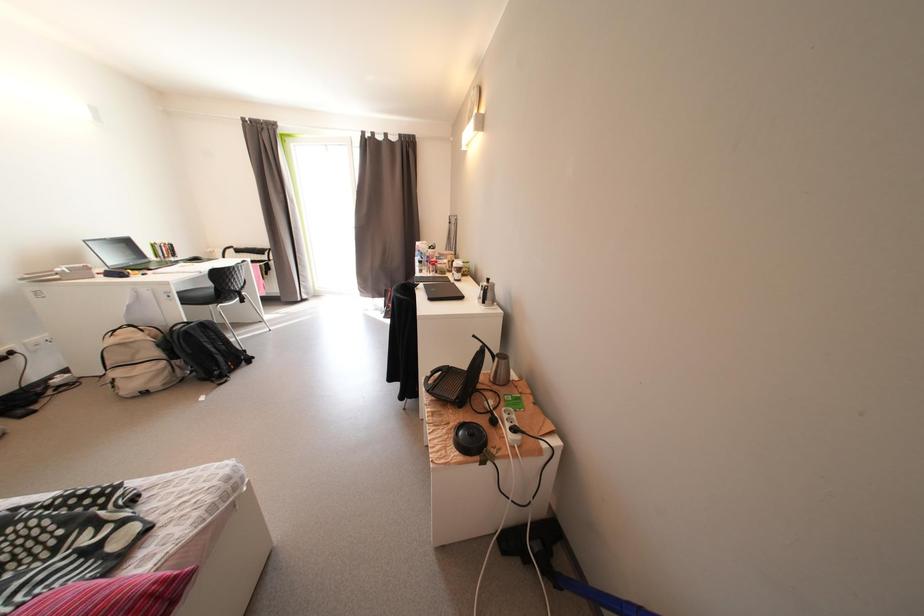
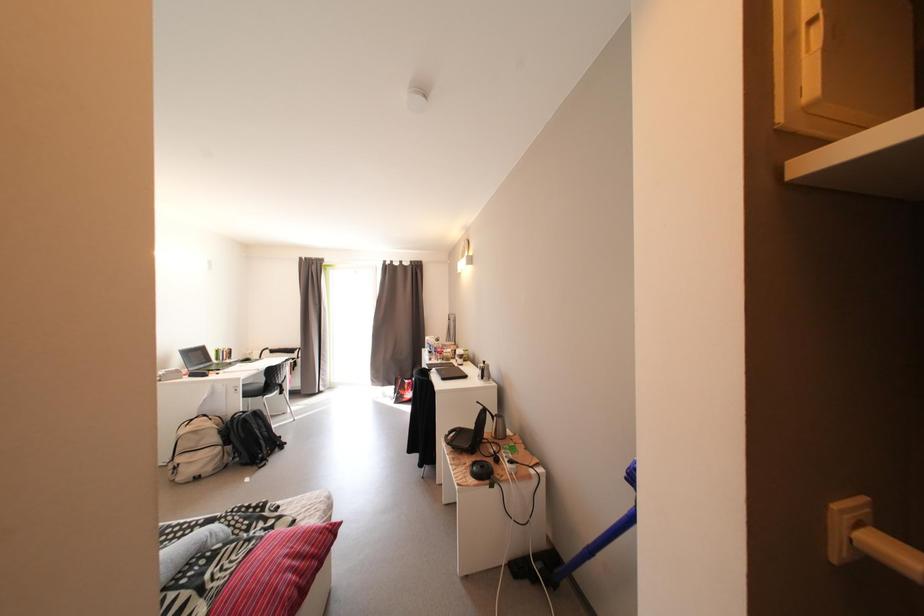
Question: The first image is from the beginning of the video and the second image is from the end. How did the camera likely rotate when shooting the video?

Choices:
 (A) Left
 (B) Right
 (C) Up
 (D) Down

Answer: (C)